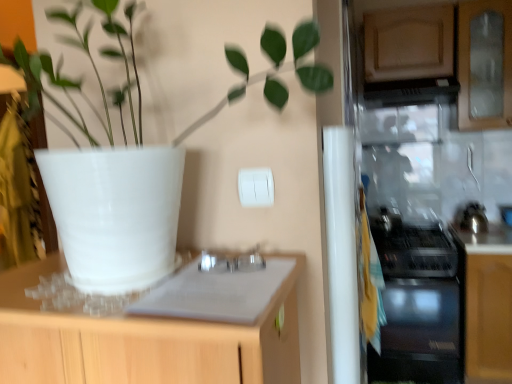
Identify the location of black glass gas stove at right. (413, 248).

Locate an element on the screen. black glossy exhaust hood at upper right is located at coordinates (411, 92).

This screenshot has width=512, height=384. Find the location of `white matte pot at upper left`. white matte pot at upper left is located at coordinates (256, 166).

The width and height of the screenshot is (512, 384). Find the location of `black glass gas stove at right`. black glass gas stove at right is located at coordinates (413, 248).

The image size is (512, 384). What are the coordinates of `gas stove on the right of black glossy exhaust hood at upper right` in the screenshot? It's located at (413, 248).

Considering the relative sizes of black glossy exhaust hood at upper right and black glass gas stove at right in the image provided, is black glossy exhaust hood at upper right smaller than black glass gas stove at right?

Yes, black glossy exhaust hood at upper right is smaller than black glass gas stove at right.

Does black glossy exhaust hood at upper right appear on the left side of black glass gas stove at right?

Yes.

Considering the sizes of black glossy exhaust hood at upper right and black glass gas stove at right in the image, is black glossy exhaust hood at upper right wider or thinner than black glass gas stove at right?

In the image, black glossy exhaust hood at upper right appears to be more narrow than black glass gas stove at right.

Is there a large distance between satin black oven at lower right and black glass gas stove at right?

satin black oven at lower right is near black glass gas stove at right, not far away.

Does point (402, 228) come farther from viewer compared to point (438, 223)?

No, (402, 228) is in front of (438, 223).

Between satin black oven at lower right and black glass gas stove at right, which one appears on the left side from the viewer's perspective?

Positioned to the left is satin black oven at lower right.

From a real-world perspective, which is physically below, black glass gas stove at right or black glossy exhaust hood at upper right?

black glass gas stove at right, from a real-world perspective.

Do you think black glass gas stove at right is within black glossy exhaust hood at upper right, or outside of it?

black glass gas stove at right cannot be found inside black glossy exhaust hood at upper right.

Considering the sizes of black glass gas stove at right and black glossy exhaust hood at upper right in the image, is black glass gas stove at right bigger or smaller than black glossy exhaust hood at upper right?

black glass gas stove at right is bigger than black glossy exhaust hood at upper right.

From the image's perspective, relative to black glossy exhaust hood at upper right, is black glass gas stove at right above or below?

Clearly, from the image's perspective, black glass gas stove at right is below black glossy exhaust hood at upper right.

Does point (448, 94) come in front of point (207, 216)?

No.

From the picture: Is black glossy exhaust hood at upper right oriented away from white matte pot at upper left?

black glossy exhaust hood at upper right is not turned away from white matte pot at upper left.

Considering the sizes of objects black glossy exhaust hood at upper right and white matte pot at upper left in the image provided, who is bigger, black glossy exhaust hood at upper right or white matte pot at upper left?

Bigger between the two is white matte pot at upper left.

Is white matte pot at upper left not within black glass gas stove at right?

That's correct, white matte pot at upper left is outside of black glass gas stove at right.

What's the angular difference between white matte pot at upper left and black glass gas stove at right's facing directions?

white matte pot at upper left and black glass gas stove at right are facing 2.21 degrees away from each other.

From a real-world perspective, which object stands above the other?

white matte pot at upper left.

How much distance is there between white matte pot at upper left and black glass gas stove at right?

The distance of white matte pot at upper left from black glass gas stove at right is 1.72 meters.

From the image's perspective, relative to white matte pot at upper left, is satin black oven at lower right above or below?

satin black oven at lower right is below white matte pot at upper left.

Is satin black oven at lower right directly adjacent to white matte pot at upper left?

There is a gap between satin black oven at lower right and white matte pot at upper left.

Considering the sizes of objects satin black oven at lower right and white matte pot at upper left in the image provided, who is smaller, satin black oven at lower right or white matte pot at upper left?

white matte pot at upper left is smaller.

Looking at their sizes, would you say satin black oven at lower right is wider or thinner than white matte pot at upper left?

In the image, satin black oven at lower right appears to be wider than white matte pot at upper left.

Which object is closer to the camera taking this photo, black glossy exhaust hood at upper right or satin black oven at lower right?

black glossy exhaust hood at upper right is in front.

Between black glossy exhaust hood at upper right and satin black oven at lower right, which one has more height?

satin black oven at lower right is taller.

How many degrees apart are the facing directions of black glossy exhaust hood at upper right and satin black oven at lower right?

The facing directions of black glossy exhaust hood at upper right and satin black oven at lower right are 0.822 degrees apart.

In the scene shown: Is black glossy exhaust hood at upper right oriented towards satin black oven at lower right?

No.

Where is `gas stove to the right of black glossy exhaust hood at upper right`? gas stove to the right of black glossy exhaust hood at upper right is located at coordinates (413, 248).

At what (x,y) coordinates should I click in order to perform the action: click on gas stove above the satin black oven at lower right (from the image's perspective). Please return your answer as a coordinate pair (x, y). This screenshot has width=512, height=384. Looking at the image, I should click on (413, 248).

Looking at the image, which one is located closer to black glossy exhaust hood at upper right, satin black oven at lower right or white matte pot at upper left?

satin black oven at lower right is positioned closer to the anchor black glossy exhaust hood at upper right.

Estimate the real-world distances between objects in this image. Which object is closer to black glossy exhaust hood at upper right, satin black oven at lower right or black glass gas stove at right?

black glass gas stove at right is positioned closer to the anchor black glossy exhaust hood at upper right.

Which object lies further to the anchor point black glass gas stove at right, black glossy exhaust hood at upper right or white matte pot at upper left?

The object further to black glass gas stove at right is white matte pot at upper left.

When comparing their distances from black glossy exhaust hood at upper right, does black glass gas stove at right or white matte pot at upper left seem further?

white matte pot at upper left is further to black glossy exhaust hood at upper right.

From the image, which object appears to be nearer to white matte pot at upper left, black glossy exhaust hood at upper right or black glass gas stove at right?

Based on the image, black glass gas stove at right appears to be nearer to white matte pot at upper left.

Estimate the real-world distances between objects in this image. Which object is further from white matte pot at upper left, satin black oven at lower right or black glossy exhaust hood at upper right?

black glossy exhaust hood at upper right is positioned further to the anchor white matte pot at upper left.

Looking at the image, which one is located further to black glossy exhaust hood at upper right, white matte pot at upper left or satin black oven at lower right?

white matte pot at upper left is further to black glossy exhaust hood at upper right.

When comparing their distances from black glass gas stove at right, does white matte pot at upper left or satin black oven at lower right seem further?

white matte pot at upper left.

Where is `exhaust hood between white matte pot at upper left and satin black oven at lower right in the front-back direction`? The image size is (512, 384). exhaust hood between white matte pot at upper left and satin black oven at lower right in the front-back direction is located at coordinates (411, 92).

At what (x,y) coordinates should I click in order to perform the action: click on gas stove between black glossy exhaust hood at upper right and satin black oven at lower right from top to bottom. Please return your answer as a coordinate pair (x, y). This screenshot has width=512, height=384. Looking at the image, I should click on tap(413, 248).

In order to click on gas stove positioned between white matte pot at upper left and black glossy exhaust hood at upper right from near to far in this screenshot , I will do (x=413, y=248).

This screenshot has height=384, width=512. In order to click on gas stove between white matte pot at upper left and satin black oven at lower right along the z-axis in this screenshot , I will do `click(413, 248)`.